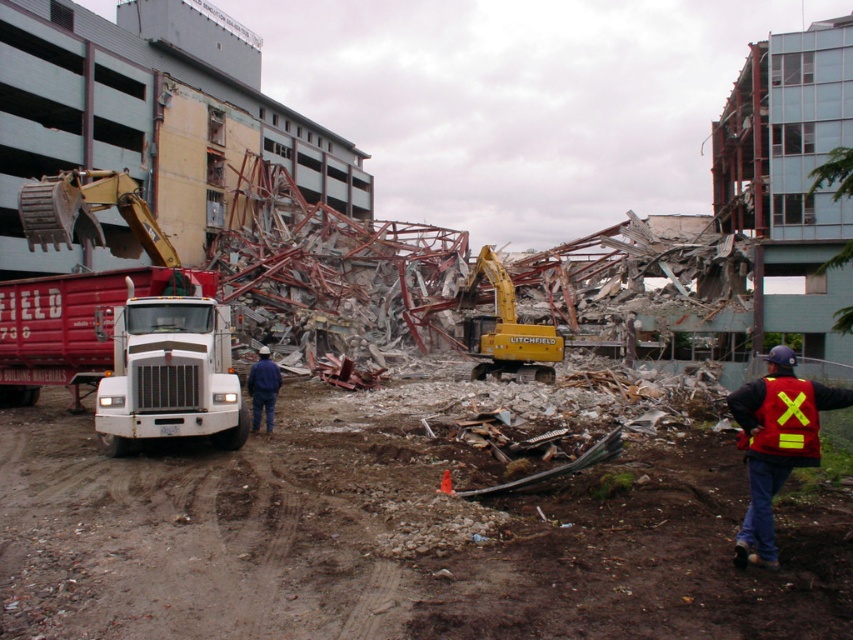
Who is taller, reflective yellow vest at center right or yellow rubber excavator at center?

Standing taller between the two is yellow rubber excavator at center.

Between reflective yellow vest at center right and yellow rubber excavator at center, which one has less height?

reflective yellow vest at center right

Does point (764, 548) come farther from viewer compared to point (476, 342)?

No, it is not.

Find the location of a particular element. The width and height of the screenshot is (853, 640). reflective yellow vest at center right is located at coordinates coord(776,442).

Is reflective yellow vest at center right further to the viewer compared to reflective red safety vest at lower right?

No, it is in front of reflective red safety vest at lower right.

Does reflective yellow vest at center right appear under reflective red safety vest at lower right?

Yes, reflective yellow vest at center right is below reflective red safety vest at lower right.

Is point (781, 465) positioned after point (769, 435)?

Yes, it is.

Identify the location of reflective yellow vest at center right. This screenshot has height=640, width=853. (776, 442).

Does reflective red safety vest at lower right appear on the right side of blue denim jeans at center?

Yes, reflective red safety vest at lower right is to the right of blue denim jeans at center.

Which is in front, point (778, 412) or point (250, 369)?

Positioned in front is point (778, 412).

This screenshot has width=853, height=640. Describe the element at coordinates (782, 419) in the screenshot. I see `reflective red safety vest at lower right` at that location.

Where is `reflective red safety vest at lower right`? reflective red safety vest at lower right is located at coordinates pyautogui.click(x=782, y=419).